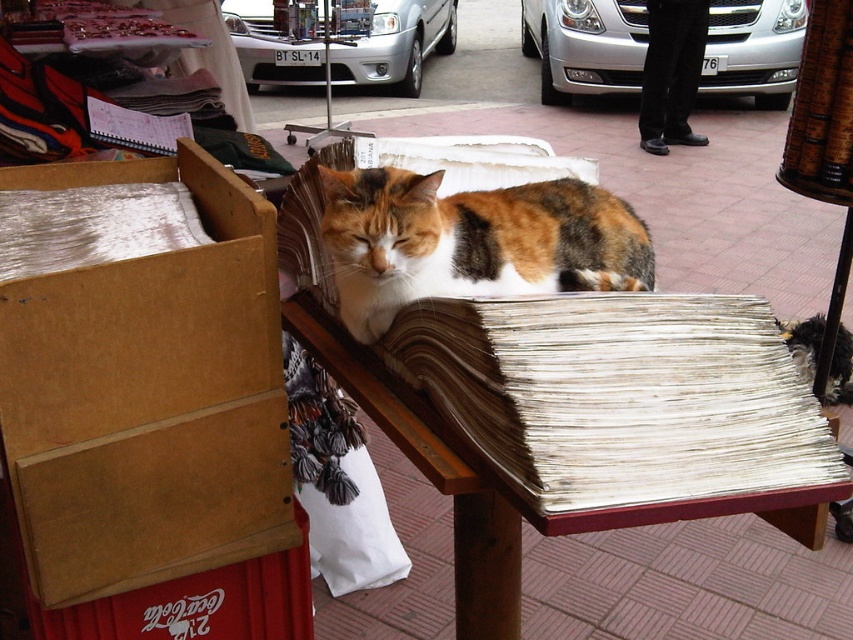
Is point (419, 454) closer to viewer compared to point (561, 49)?

That is True.

Is wooden table at center shorter than metallic silver car at center?

Correct, wooden table at center is not as tall as metallic silver car at center.

Between point (480, 566) and point (782, 72), which one is positioned behind?

Positioned behind is point (782, 72).

I want to click on wooden table at center, so click(x=508, y=483).

Is calico fur cat at center taller than metallic silver car at center?

In fact, calico fur cat at center may be shorter than metallic silver car at center.

Does calico fur cat at center appear over metallic silver car at center?

No.

Who is more distant from viewer, (503, 292) or (759, 99)?

Positioned behind is point (759, 99).

Where is `calico fur cat at center`? calico fur cat at center is located at coordinates (471, 241).

Is point (120, 444) farther from viewer compared to point (463, 264)?

That is False.

Describe the element at coordinates (140, 372) in the screenshot. I see `brown cardboard box at left` at that location.

Between point (152, 346) and point (428, 264), which one is positioned behind?

The point (428, 264) is behind.

The width and height of the screenshot is (853, 640). What are the coordinates of `brown cardboard box at left` in the screenshot? It's located at (140, 372).